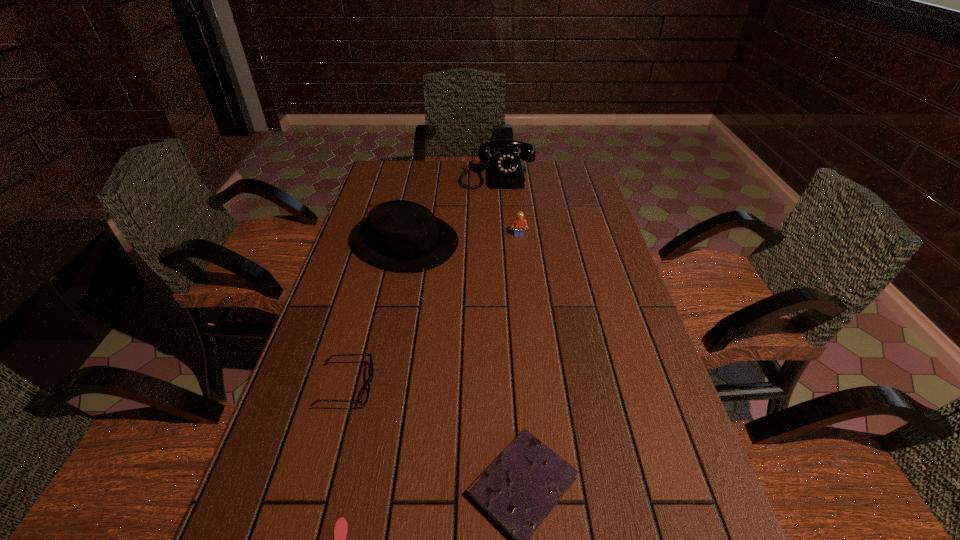
Select which object appears as the fourth closest to the shortest object. Please provide its 2D coordinates. Your answer should be formatted as a tuple, i.e. [(x, y)], where the tuple contains the x and y coordinates of a point satisfying the conditions above.

[(518, 224)]

Select which object appears as the third closest to the shortest object. Please provide its 2D coordinates. Your answer should be formatted as a tuple, i.e. [(x, y)], where the tuple contains the x and y coordinates of a point satisfying the conditions above.

[(402, 235)]